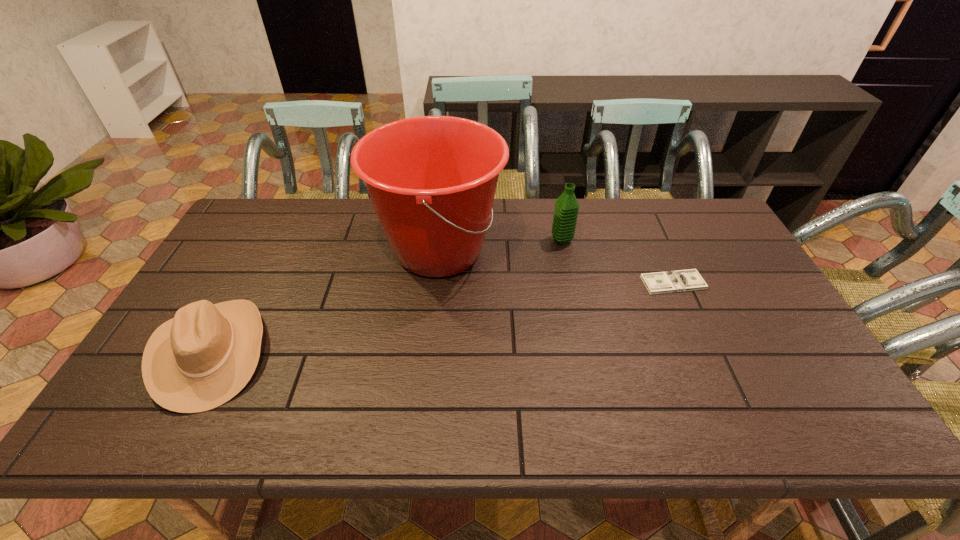
I want to click on vacant space at the near right corner of the desktop, so click(788, 428).

The height and width of the screenshot is (540, 960). Identify the location of free space between the water bottle and the shortest object. (617, 261).

The width and height of the screenshot is (960, 540). Find the location of `free space between the rightmost object and the second object from left to right`. free space between the rightmost object and the second object from left to right is located at coordinates (556, 267).

Where is `vacant region between the nearest object and the third shortest object`? vacant region between the nearest object and the third shortest object is located at coordinates (386, 296).

The width and height of the screenshot is (960, 540). Find the location of `free space between the dollar and the water bottle`. free space between the dollar and the water bottle is located at coordinates (617, 261).

At what (x,y) coordinates should I click in order to perform the action: click on vacant area between the rightmost object and the leftmost object. Please return your answer as a coordinate pair (x, y). This screenshot has width=960, height=540. Looking at the image, I should click on (442, 318).

The height and width of the screenshot is (540, 960). Find the location of `unoccupied position between the bucket and the rightmost object`. unoccupied position between the bucket and the rightmost object is located at coordinates (556, 267).

What are the coordinates of `vacant region between the shortest object and the leftmost object` in the screenshot? It's located at (442, 318).

Locate an element on the screen. The image size is (960, 540). free spot between the second shortest object and the rightmost object is located at coordinates (442, 318).

Locate an element on the screen. vacant area between the nearest object and the second tallest object is located at coordinates (386, 296).